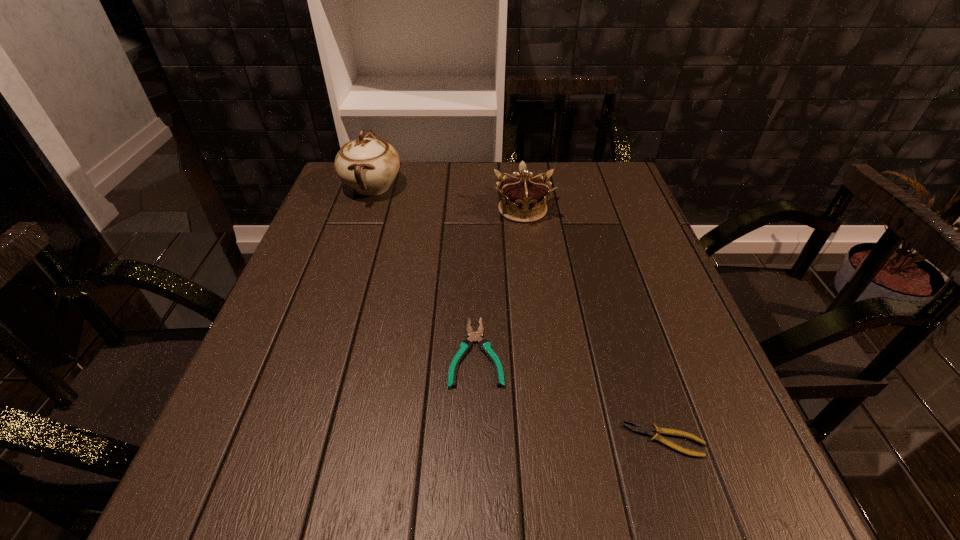
The width and height of the screenshot is (960, 540). In order to click on vacant space that is in between the farther pliers and the nearer pliers in this screenshot , I will do `click(570, 396)`.

Locate an element on the screen. The width and height of the screenshot is (960, 540). the second closest object to the chinaware is located at coordinates (465, 346).

The height and width of the screenshot is (540, 960). Find the location of `object that is the third closest one to the nearest object`. object that is the third closest one to the nearest object is located at coordinates (368, 165).